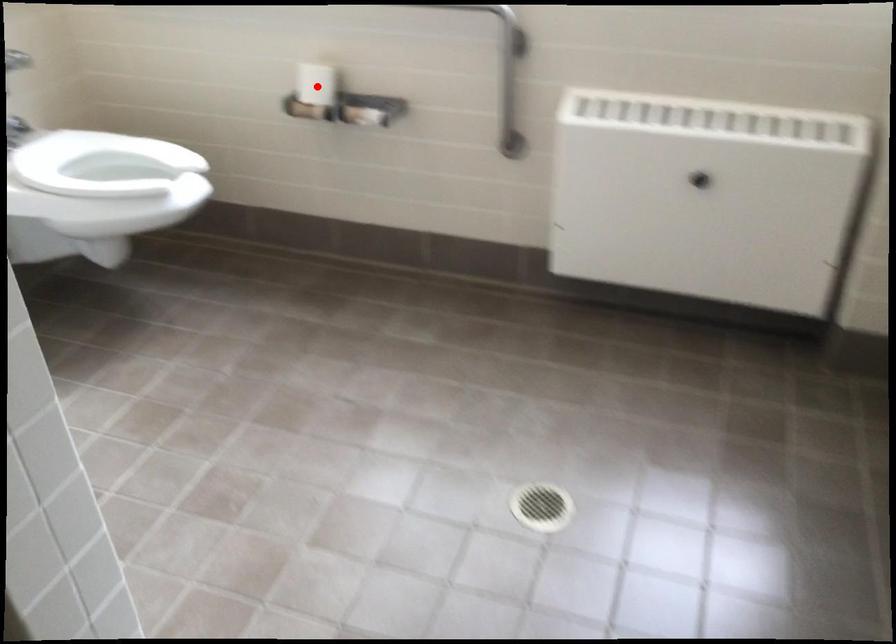
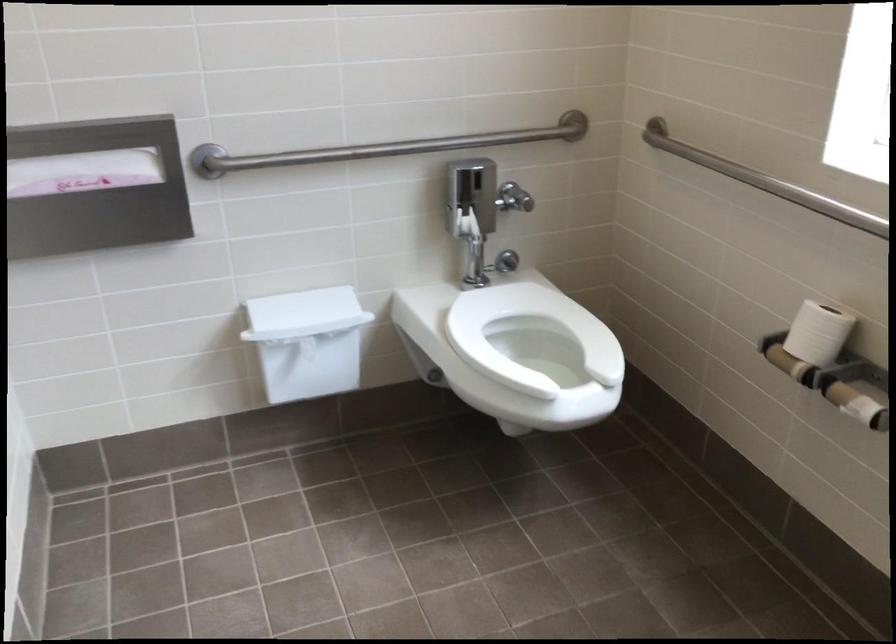
Find the pixel in the second image that matches the highlighted location in the first image.

(817, 333)